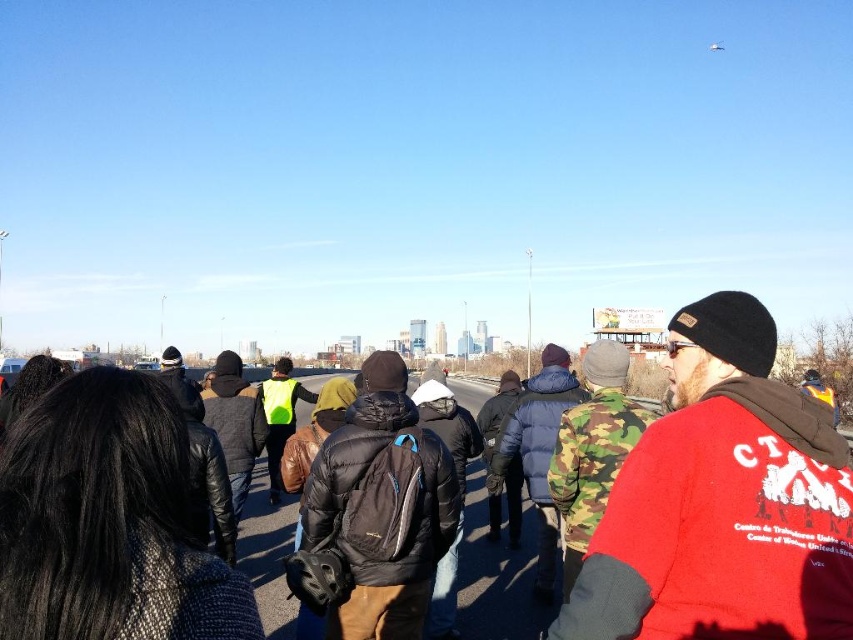
Does point (410, 429) come farther from viewer compared to point (606, 493)?

That is True.

What do you see at coordinates (361, 486) in the screenshot?
I see `black puffy jacket at center` at bounding box center [361, 486].

Where is `black puffy jacket at center`? black puffy jacket at center is located at coordinates (361, 486).

How far apart are black knit sweater at lower left and black puffy jacket at center?

They are 24.15 meters apart.

Between black knit sweater at lower left and black puffy jacket at center, which one is positioned lower?

Positioned lower is black puffy jacket at center.

I want to click on black knit sweater at lower left, so click(x=108, y=522).

Is red fleece jacket at center shorter than black knit sweater at lower left?

No.

Who is more forward, (755, 317) or (9, 625)?

Point (9, 625) is in front.

Between point (809, 552) and point (175, 512), which one is positioned behind?

The point (809, 552) is more distant.

Locate an element on the screen. Image resolution: width=853 pixels, height=640 pixels. red fleece jacket at center is located at coordinates (722, 500).